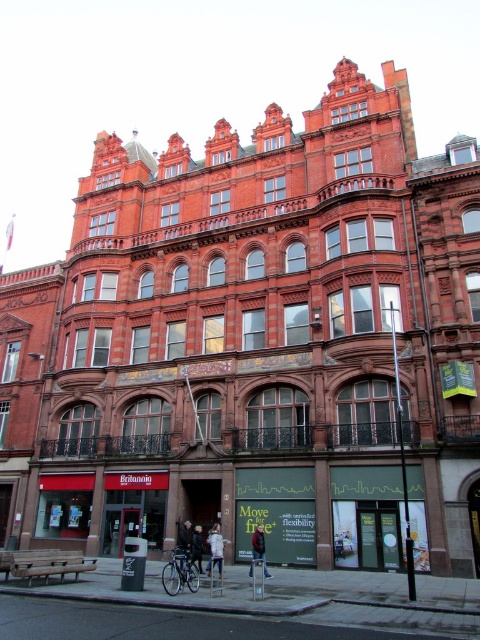
Question: Can you confirm if white cotton shirt at center is positioned above dark gray fabric jacket at center?

Choices:
 (A) yes
 (B) no

Answer: (A)

Question: Is shiny metallic bicycle at center in front of dark brown leather jacket at center?

Choices:
 (A) yes
 (B) no

Answer: (A)

Question: Does shiny metallic bicycle at center lie behind dark brown leather jacket at center?

Choices:
 (A) yes
 (B) no

Answer: (B)

Question: Which of the following is the closest to the observer?

Choices:
 (A) (182, 556)
 (B) (200, 552)

Answer: (A)

Question: Which of the following is the farthest from the observer?

Choices:
 (A) (191, 540)
 (B) (186, 556)

Answer: (A)

Question: Which object is positioned farthest from the dark gray fabric jacket at center?

Choices:
 (A) white cotton shirt at center
 (B) dark gray jacket at lower center
 (C) dark brown leather jacket at center

Answer: (B)